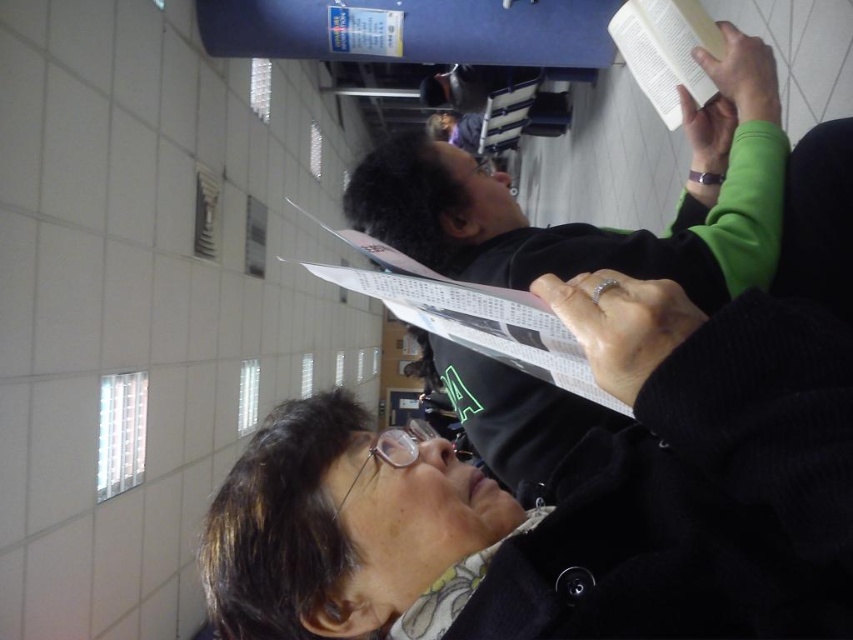
Looking at this image, how much distance is there between black matte book at upper center and white paper book at upper right?

They are 12.24 inches apart.

Which is behind, point (465, 385) or point (651, 8)?

The point (465, 385) is behind.

Where is `black matte book at upper center`? black matte book at upper center is located at coordinates (590, 225).

Is black matte paper at center shorter than paper at center?

In fact, black matte paper at center may be taller than paper at center.

Which is below, black matte paper at center or paper at center?

Positioned lower is black matte paper at center.

Locate an element on the screen. Image resolution: width=853 pixels, height=640 pixels. black matte paper at center is located at coordinates (693, 481).

Who is more forward, (479, 285) or (682, 54)?

Point (479, 285)

Measure the distance between point (x=439, y=296) and camera.

A distance of 22.60 inches exists between point (x=439, y=296) and camera.

Does point (521, 307) come in front of point (616, 29)?

Yes, it is in front of point (616, 29).

Find the location of a particular element. This screenshot has height=640, width=853. paper at center is located at coordinates (468, 314).